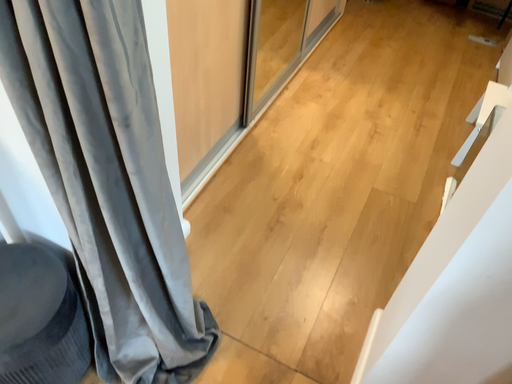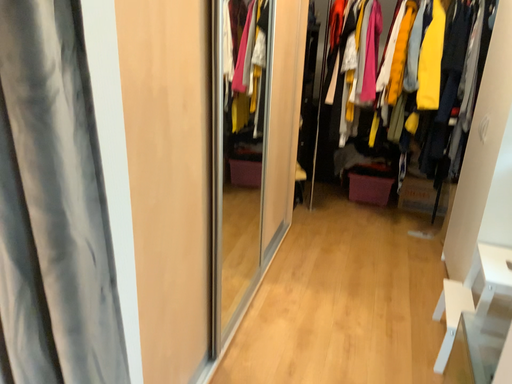
Question: Which way did the camera rotate in the video?

Choices:
 (A) rotated downward
 (B) rotated upward

Answer: (B)